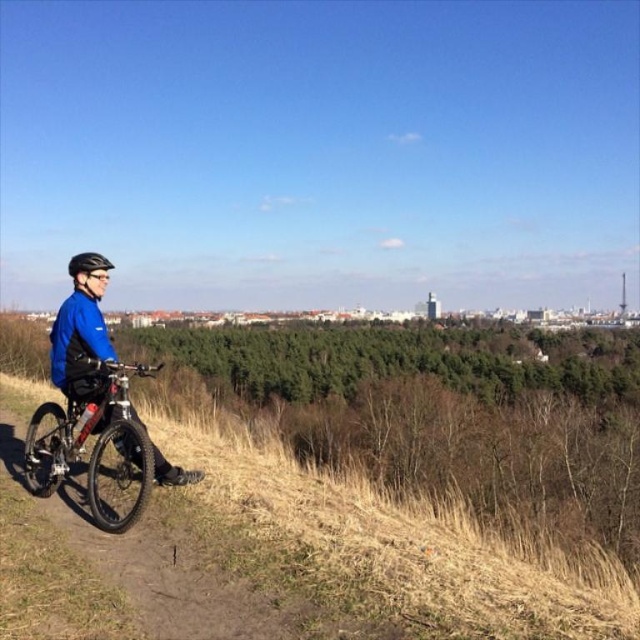
Question: Is shiny metallic bicycle at lower left closer to camera compared to black matte helmet at left?

Choices:
 (A) yes
 (B) no

Answer: (A)

Question: Which point is closer to the camera?

Choices:
 (A) black matte helmet at left
 (B) shiny metallic bicycle at lower left

Answer: (B)

Question: Can you confirm if shiny metallic bicycle at lower left is positioned below black matte helmet at left?

Choices:
 (A) yes
 (B) no

Answer: (A)

Question: Is shiny metallic bicycle at lower left in front of black matte helmet at left?

Choices:
 (A) yes
 (B) no

Answer: (A)

Question: Which point is farther from the camera taking this photo?

Choices:
 (A) (134, 456)
 (B) (84, 268)

Answer: (B)

Question: Which point is farther to the camera?

Choices:
 (A) shiny metallic bicycle at lower left
 (B) black matte helmet at left

Answer: (B)